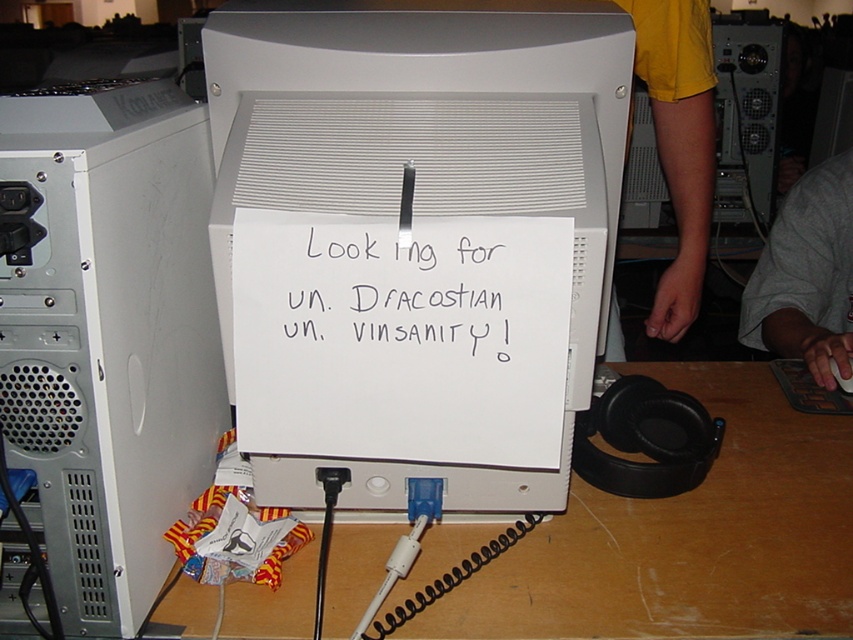
Question: Which of the following is the farthest from the observer?

Choices:
 (A) wooden table at lower center
 (B) white paper at center
 (C) silver metallic desktop computer at left

Answer: (A)

Question: Does wooden table at lower center appear over white paper at center?

Choices:
 (A) yes
 (B) no

Answer: (B)

Question: Which of these objects is positioned closest to the silver metallic desktop computer at left?

Choices:
 (A) white paper at center
 (B) wooden table at lower center

Answer: (A)

Question: Can you confirm if white plastic monitor at center is positioned to the right of wooden table at lower center?

Choices:
 (A) no
 (B) yes

Answer: (A)

Question: Which of these objects is positioned farthest from the wooden table at lower center?

Choices:
 (A) white plastic monitor at center
 (B) silver metallic desktop computer at left

Answer: (A)

Question: Does white plastic monitor at center appear on the right side of wooden table at lower center?

Choices:
 (A) no
 (B) yes

Answer: (A)